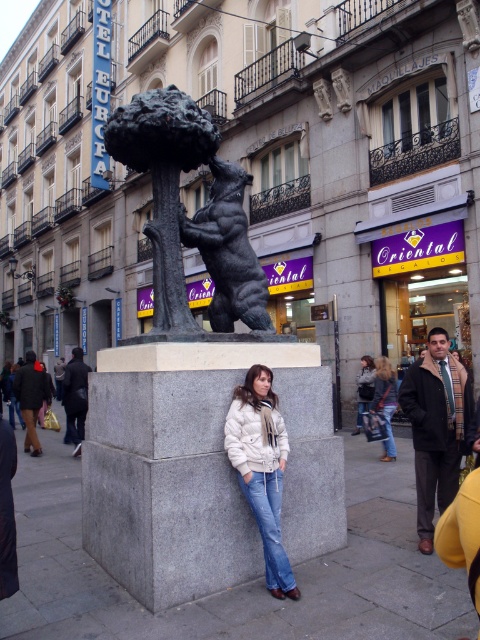
Which is more to the left, bronze bear at center or black polished stone bear at center?

Positioned to the left is bronze bear at center.

Which is behind, point (235, 310) or point (228, 189)?

The point (228, 189) is more distant.

What are the coordinates of `bronze bear at center` in the screenshot? It's located at (186, 216).

In the scene shown: Is bronze bear at center bigger than white puffy jacket at center?

Indeed, bronze bear at center has a larger size compared to white puffy jacket at center.

Locate an element on the screen. bronze bear at center is located at coordinates (186, 216).

Can you confirm if dark brown leather jacket at lower right is positioned below denim jacket at lower right?

No.

Does dark brown leather jacket at lower right appear over denim jacket at lower right?

Correct, dark brown leather jacket at lower right is located above denim jacket at lower right.

Between point (414, 435) and point (373, 401), which one is positioned behind?

Point (373, 401)

You are a GUI agent. You are given a task and a screenshot of the screen. Output one action in this format:
    pyautogui.click(x=<x>, y=<y>)
    Task: Click on the dark brown leather jacket at lower right
    
    Given the screenshot: What is the action you would take?
    pyautogui.click(x=435, y=428)